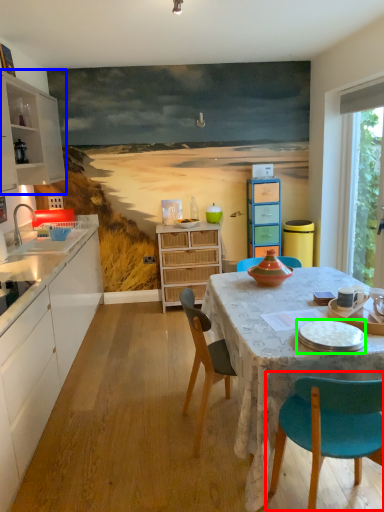
Question: Estimate the real-world distances between objects in this image. Which object is farther from chair (highlighted by a red box), cabinetry (highlighted by a blue box) or tableware (highlighted by a green box)?

Choices:
 (A) cabinetry
 (B) tableware

Answer: (A)